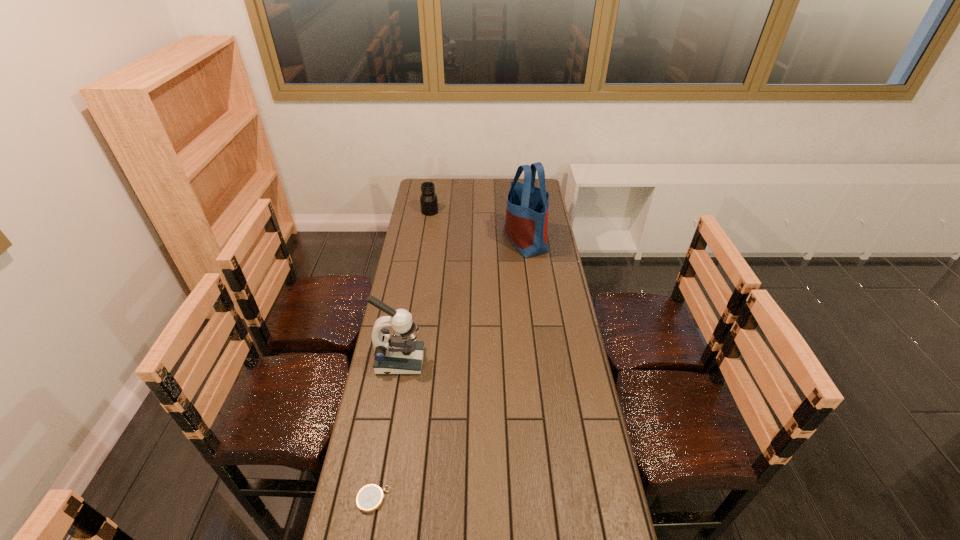
This screenshot has width=960, height=540. I want to click on vacant region located on the right of the jar, so click(500, 212).

I want to click on vacant space located on the back of the nearest object, so click(x=379, y=465).

The height and width of the screenshot is (540, 960). In order to click on microscope that is positioned at the left edge in this screenshot , I will do `click(401, 354)`.

Where is `jar that is at the left edge`? jar that is at the left edge is located at coordinates (428, 200).

Where is `compass that is positioned at the left edge`? The image size is (960, 540). compass that is positioned at the left edge is located at coordinates (370, 497).

In order to click on object that is at the right edge in this screenshot , I will do `click(526, 225)`.

At what (x,y) coordinates should I click in order to perform the action: click on vacant region at the far edge of the desktop. Please return your answer as a coordinate pair (x, y). Looking at the image, I should click on (477, 179).

You are a GUI agent. You are given a task and a screenshot of the screen. Output one action in this format:
    pyautogui.click(x=<x>, y=<y>)
    Task: Click on the blank area at the left edge
    
    Given the screenshot: What is the action you would take?
    pyautogui.click(x=372, y=406)

Identify the location of vacant region at the right edge. Image resolution: width=960 pixels, height=540 pixels. (579, 397).

This screenshot has width=960, height=540. Identify the location of empty space that is in between the microscope and the jar. (415, 286).